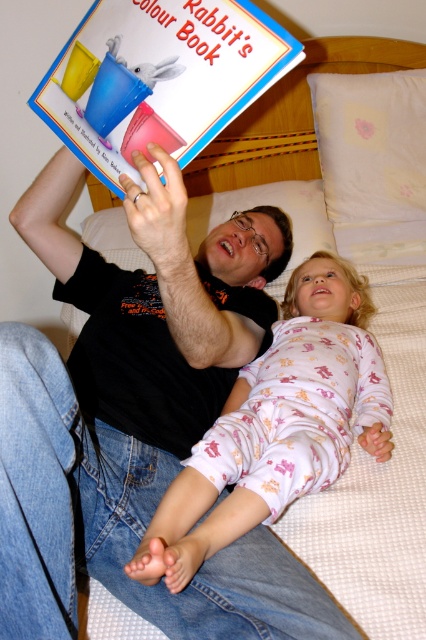
Who is positioned more to the left, white soft pillow at upper right or white soft pillow at upper center?

From the viewer's perspective, white soft pillow at upper center appears more on the left side.

Between white soft pillow at upper right and white soft pillow at upper center, which one appears on the right side from the viewer's perspective?

white soft pillow at upper right is more to the right.

Which is in front, point (376, 188) or point (293, 268)?

Point (293, 268)

Locate an element on the screen. white soft pillow at upper right is located at coordinates (371, 145).

Does hardcover book at upper center appear on the left side of white soft pillow at upper right?

Yes, hardcover book at upper center is to the left of white soft pillow at upper right.

Does point (129, 1) come closer to viewer compared to point (333, 132)?

Yes.

Identify the location of hardcover book at upper center. (158, 77).

Between white cotton pajamas at center and white soft pillow at upper center, which one appears on the right side from the viewer's perspective?

From the viewer's perspective, white cotton pajamas at center appears more on the right side.

Does white cotton pajamas at center lie in front of white soft pillow at upper center?

Yes, white cotton pajamas at center is closer to the viewer.

At what (x,y) coordinates should I click in order to perform the action: click on white cotton pajamas at center. Please return your answer as a coordinate pair (x, y). Image resolution: width=426 pixels, height=640 pixels. Looking at the image, I should click on (276, 426).

Locate an element on the screen. The image size is (426, 640). white cotton pajamas at center is located at coordinates (276, 426).